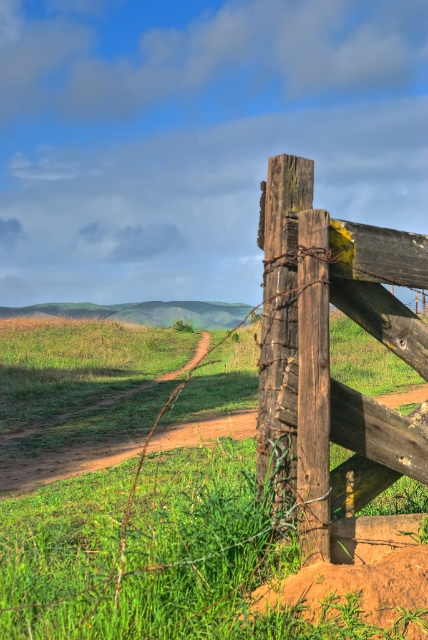
The width and height of the screenshot is (428, 640). Describe the element at coordinates (327, 344) in the screenshot. I see `weathered wood fence at right` at that location.

Who is positioned more to the right, weathered wood fence at right or green grassy hill at center?

weathered wood fence at right

Does point (290, 429) come closer to viewer compared to point (186, 307)?

Yes, it is in front of point (186, 307).

Locate an element on the screen. weathered wood fence at right is located at coordinates (327, 344).

Between green grassy at center and green grassy hill at center, which one is positioned higher?

green grassy hill at center is higher up.

Which of these two, green grassy at center or green grassy hill at center, stands taller?

Standing taller between the two is green grassy hill at center.

Does point (100, 605) come in front of point (187, 307)?

Yes, it is in front of point (187, 307).

Where is `green grassy at center`? The height and width of the screenshot is (640, 428). green grassy at center is located at coordinates (142, 550).

Looking at this image, is green grassy at center shorter than weathered wood fence at right?

Indeed, green grassy at center has a lesser height compared to weathered wood fence at right.

Is green grassy at center taller than weathered wood fence at right?

Incorrect, green grassy at center's height is not larger of weathered wood fence at right's.

This screenshot has height=640, width=428. Identify the location of green grassy at center. (142, 550).

In order to click on green grassy at center in this screenshot , I will do `click(142, 550)`.